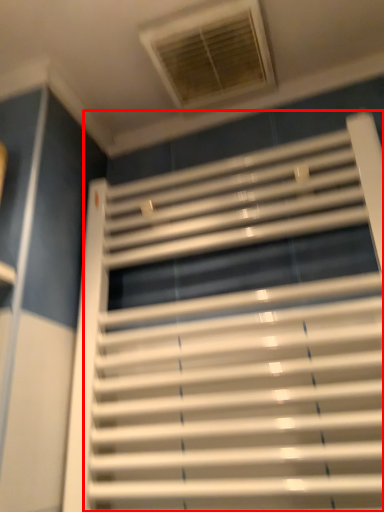
Question: From the image's perspective, considering the relative positions of window blind (annotated by the red box) and window in the image provided, where is window blind (annotated by the red box) located with respect to the staircase?

Choices:
 (A) above
 (B) below

Answer: (B)